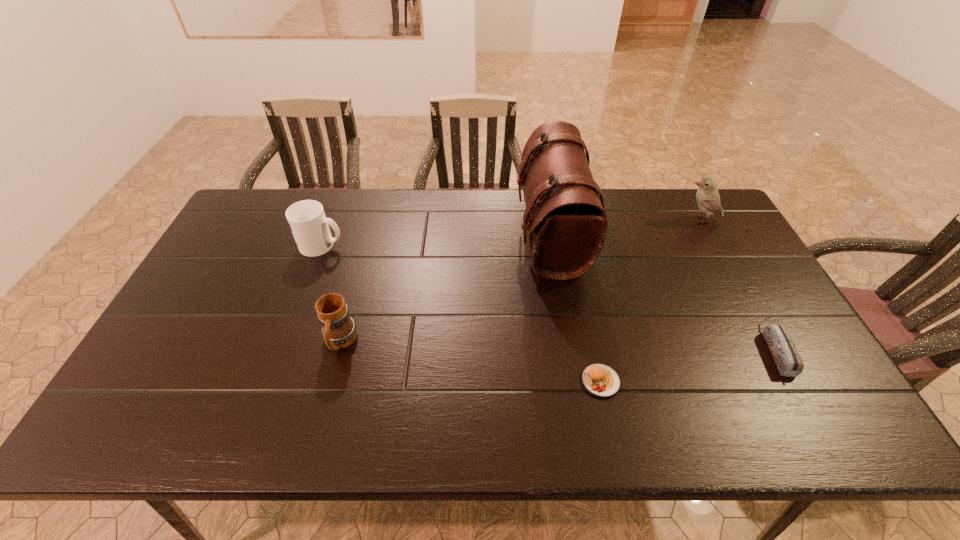
Locate an element on the screen. The width and height of the screenshot is (960, 540). free spot that satisfies the following two spatial constraints: 1. on the front-facing side of the patty; 2. on the left side of the tallest object is located at coordinates (575, 381).

This screenshot has width=960, height=540. Identify the location of free region that satisfies the following two spatial constraints: 1. on the side of the nearer mug with the handle; 2. on the right side of the patty. (329, 381).

Where is `free spot that satisfies the following two spatial constraints: 1. at the face of the bird; 2. on the left side of the pencil box`? free spot that satisfies the following two spatial constraints: 1. at the face of the bird; 2. on the left side of the pencil box is located at coordinates (771, 349).

You are a GUI agent. You are given a task and a screenshot of the screen. Output one action in this format:
    pyautogui.click(x=<x>, y=<y>)
    Task: Click on the vacant position in the image that satisfies the following two spatial constraints: 1. on the front-facing side of the pencil box; 2. on the right side of the satchel
    The image size is (960, 540).
    Given the screenshot: What is the action you would take?
    pyautogui.click(x=570, y=349)

Locate an element on the screen. vacant space that satisfies the following two spatial constraints: 1. on the handle side of the patty; 2. on the right side of the left mug is located at coordinates (272, 381).

At what (x,y) coordinates should I click in order to perform the action: click on free point that satisfies the following two spatial constraints: 1. on the side of the pencil box with the handle; 2. on the left side of the right mug. Please return your answer as a coordinate pair (x, y). This screenshot has width=960, height=540. Looking at the image, I should click on pos(338,349).

You are a GUI agent. You are given a task and a screenshot of the screen. Output one action in this format:
    pyautogui.click(x=<x>, y=<y>)
    Task: Click on the blank area in the image that satisfies the following two spatial constraints: 1. on the handle side of the leftmost object; 2. on the left side of the patty
    Image resolution: width=960 pixels, height=540 pixels.
    Given the screenshot: What is the action you would take?
    pyautogui.click(x=272, y=381)

Where is `vacant area in the image that satisfies the following two spatial constraints: 1. on the front-facing side of the patty; 2. on the right side of the satchel`? The height and width of the screenshot is (540, 960). vacant area in the image that satisfies the following two spatial constraints: 1. on the front-facing side of the patty; 2. on the right side of the satchel is located at coordinates (575, 381).

The height and width of the screenshot is (540, 960). Find the location of `free space that satisfies the following two spatial constraints: 1. on the back side of the patty; 2. on the handle side of the left mug`. free space that satisfies the following two spatial constraints: 1. on the back side of the patty; 2. on the handle side of the left mug is located at coordinates (571, 245).